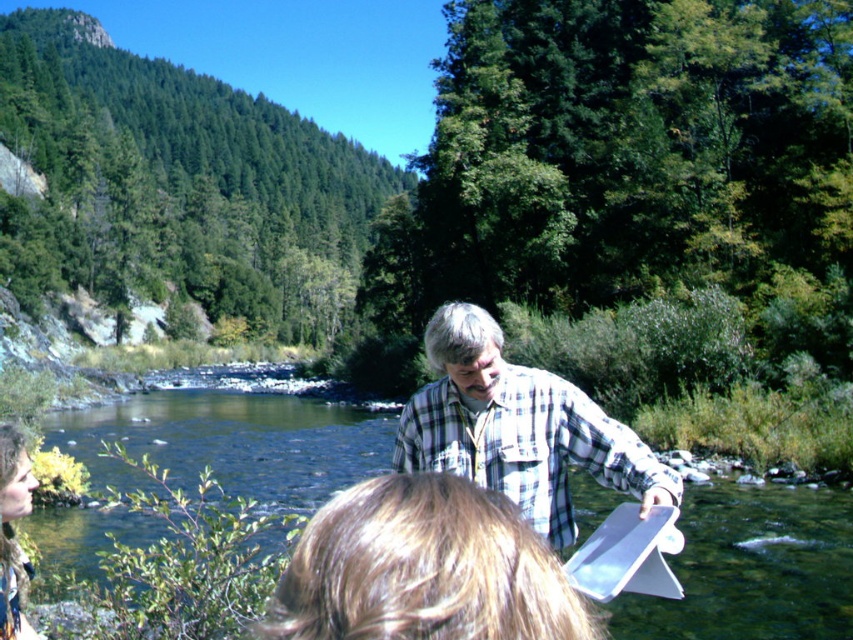
Question: Which object is the farthest from the clear water at creek center?

Choices:
 (A) camouflage fabric jacket at lower left
 (B) white paper clipboard at center
 (C) blonde hair at center
 (D) plaid cotton shirt at center

Answer: (A)

Question: In this image, where is clear water at creek center located relative to blonde hair at center?

Choices:
 (A) above
 (B) below

Answer: (B)

Question: Which object appears closest to the camera in this image?

Choices:
 (A) camouflage fabric jacket at lower left
 (B) white paper clipboard at center
 (C) plaid cotton shirt at center

Answer: (C)

Question: Can you confirm if white paper clipboard at center is positioned to the left of camouflage fabric jacket at lower left?

Choices:
 (A) no
 (B) yes

Answer: (A)

Question: Is blonde hair at center smaller than plaid cotton shirt at center?

Choices:
 (A) yes
 (B) no

Answer: (A)

Question: Which point appears farthest from the camera in this image?

Choices:
 (A) (434, 467)
 (B) (344, 538)
 (C) (627, 529)

Answer: (A)